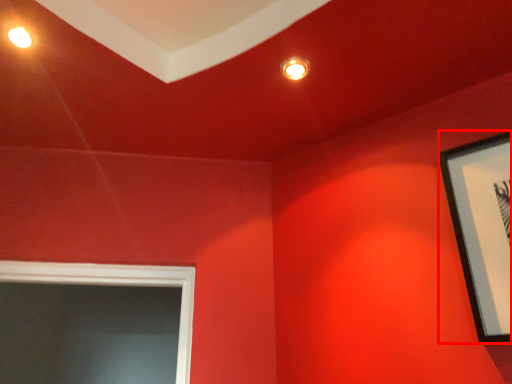
Question: Observing the image, what is the correct spatial positioning of picture frame (annotated by the red box) in reference to lighting?

Choices:
 (A) left
 (B) right

Answer: (B)